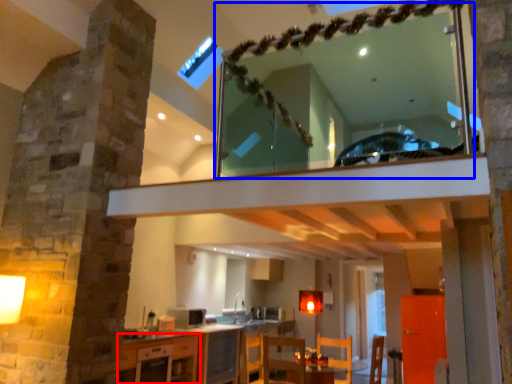
Question: Among these objects, which one is farthest to the camera, cabinetry (highlighted by a red box) or mirror (highlighted by a blue box)?

Choices:
 (A) cabinetry
 (B) mirror

Answer: (A)